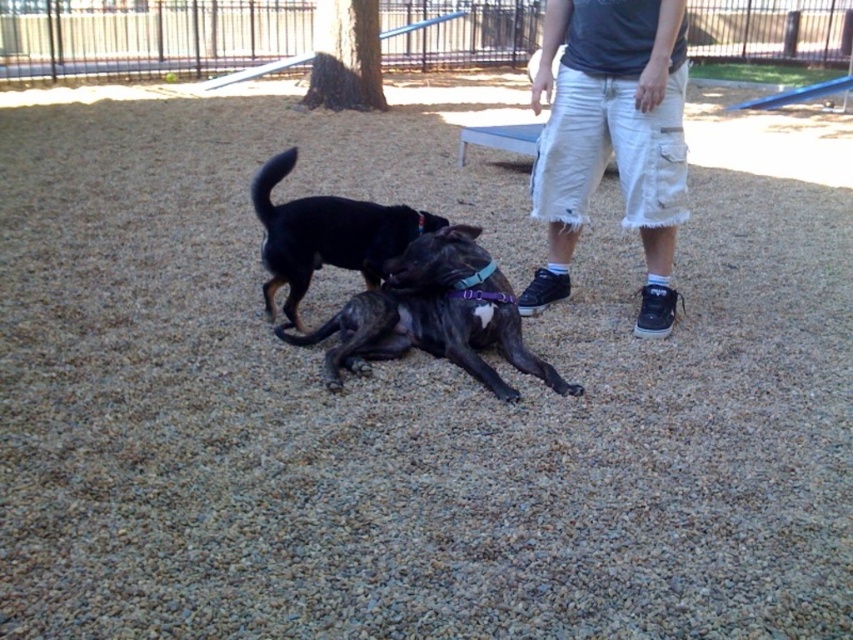
Question: Among these objects, which one is nearest to the camera?

Choices:
 (A) black matte dog at center
 (B) brindle fur dog at center
 (C) white cotton shorts at right

Answer: (B)

Question: Which object is farther from the camera taking this photo?

Choices:
 (A) brindle fur dog at center
 (B) black matte dog at center

Answer: (B)

Question: Is the position of brindle fur dog at center less distant than that of black matte dog at center?

Choices:
 (A) yes
 (B) no

Answer: (A)

Question: Is white cotton shorts at right further to camera compared to black matte dog at center?

Choices:
 (A) yes
 (B) no

Answer: (B)

Question: Among these points, which one is nearest to the camera?

Choices:
 (A) (492, 374)
 (B) (271, 168)
 (C) (585, 67)

Answer: (A)

Question: Is the position of white cotton shorts at right less distant than that of black matte dog at center?

Choices:
 (A) no
 (B) yes

Answer: (B)